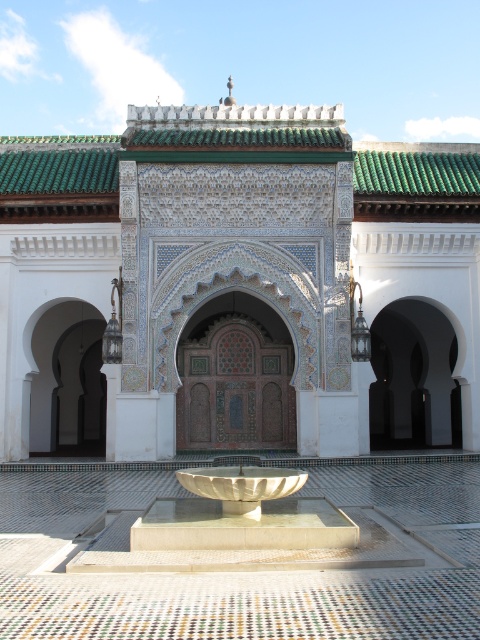
Consider the image. You are an architect designing a new garden layout. You have two central features to place in the garden design. You have a white mosaic tile palace at center and a white marble fountain at center. Which one should be placed in a larger area to match their sizes?

The white mosaic tile palace at center is bigger than the white marble fountain at center, so it should be placed in a larger area to accommodate its size.

You are standing in front of the ornate archway and notice two objects at the center. Which object is closer to you between the white mosaic tile palace at center and the white stone bowl at center?

The white mosaic tile palace at center is closer to you since the white stone bowl at center is positioned behind it.